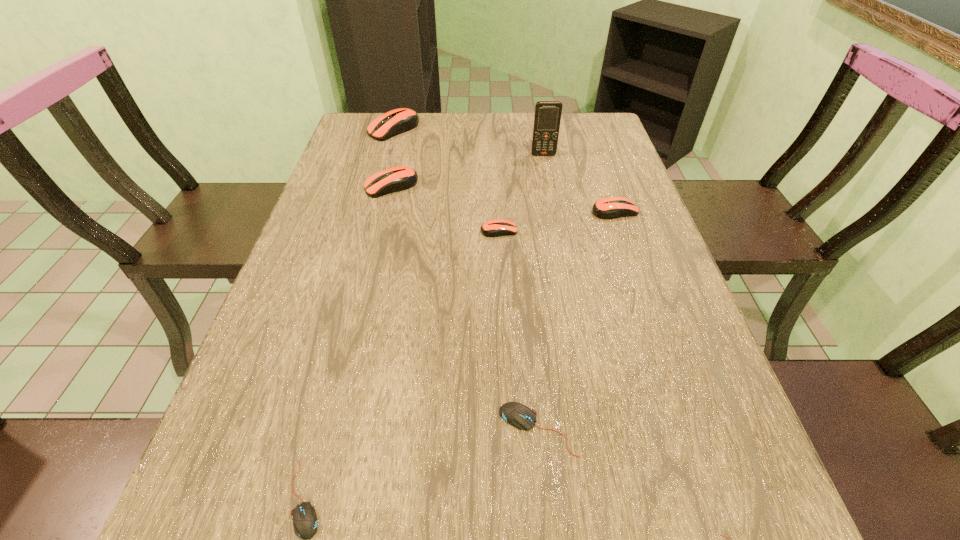
Where is `the seventh closest object to the smallest orange computer mouse`? The height and width of the screenshot is (540, 960). the seventh closest object to the smallest orange computer mouse is located at coordinates (718, 535).

In order to click on the fifth closest object relative to the orange cellular telephone in this screenshot , I will do `click(516, 414)`.

This screenshot has width=960, height=540. In order to click on mouse that is the sixth nearest to the biggest orange computer mouse in this screenshot , I will do `click(718, 535)`.

Find the location of a particular element. the third closest mouse to the third farthest orange computer mouse is located at coordinates (516, 414).

Image resolution: width=960 pixels, height=540 pixels. I want to click on orange computer mouse that stands as the closest to the smallest black mouse, so click(493, 228).

Identify the location of orange computer mouse that stands as the second closest to the orange cellular telephone. (493, 228).

Locate an element on the screen. The height and width of the screenshot is (540, 960). the second closest black mouse to the rightmost black mouse is located at coordinates (305, 520).

Where is `the second closest black mouse to the farthest object`? the second closest black mouse to the farthest object is located at coordinates (305, 520).